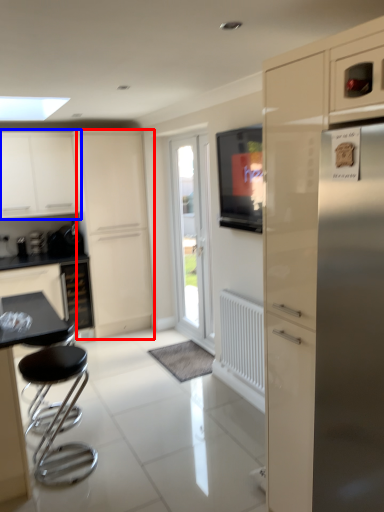
Question: Which point is closer to the camera, screen door (highlighted by a red box) or cabinetry (highlighted by a blue box)?

Choices:
 (A) screen door
 (B) cabinetry

Answer: (B)